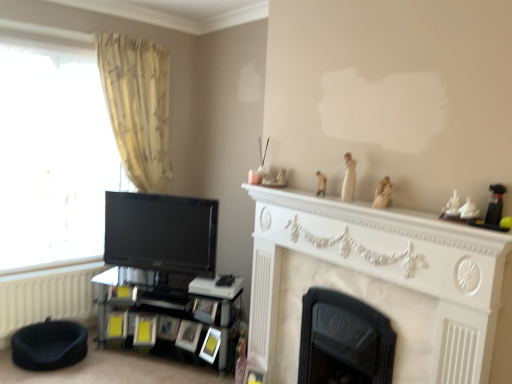
Locate an element on the screen. vacant space to the right of dark blue fabric bean bag chair at lower left is located at coordinates (114, 360).